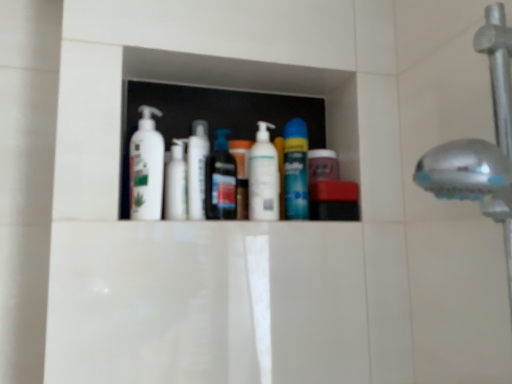
Question: In terms of height, does white matte lotion at center, positioned as the first cleaning product in left-to-right order, look taller or shorter compared to white glossy pump bottle at center, the first toiletry from the right?

Choices:
 (A) tall
 (B) short

Answer: (A)

Question: From the image's perspective, is white matte lotion at center, positioned as the first cleaning product in left-to-right order, positioned above or below white glossy pump bottle at center, the first toiletry from the right?

Choices:
 (A) below
 (B) above

Answer: (B)

Question: Which object is the farthest from the white glossy pump bottle at center, the 1th cleaning product in the right-to-left sequence?

Choices:
 (A) translucent plastic mouthwash at center, the second mouthwash positioned from the right
 (B) white glossy lotion at center, placed as the third toiletry when sorted from right to left
 (C) white matte lotion at center, the second cleaning product positioned from the right
 (D) white glossy pump bottle at center, the first toiletry from the right
 (E) white glossy lotion at center, placed as the second toiletry when sorted from left to right

Answer: (C)

Question: Estimate the real-world distances between objects in this image. Which object is farther from the translucent plastic mouthwash at center, placed as the 1th mouthwash when sorted from left to right?

Choices:
 (A) white glossy pump bottle at center, the 1th cleaning product in the right-to-left sequence
 (B) white matte lotion at center, the second cleaning product positioned from the right
 (C) blue glossy can at center, which is the 1th mouthwash in right-to-left order
 (D) white glossy pump bottle at center, the first toiletry from the right
 (E) white glossy lotion at center, acting as the 2th toiletry starting from the right

Answer: (C)